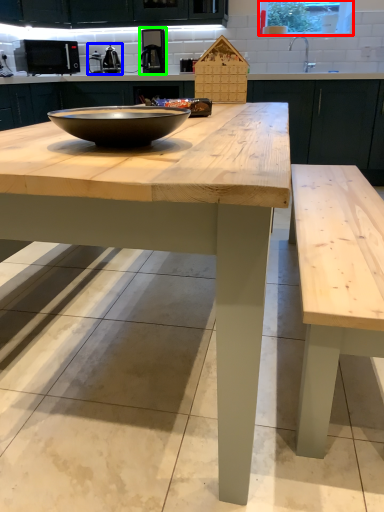
Question: Which is nearer to the window screen (highlighted by a red box)? appliance (highlighted by a blue box) or coffee machine (highlighted by a green box).

Choices:
 (A) appliance
 (B) coffee machine

Answer: (B)